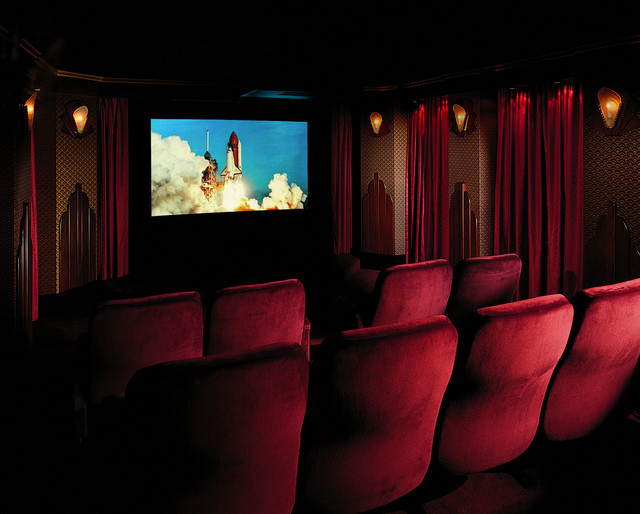
You are a GUI agent. You are given a task and a screenshot of the screen. Output one action in this format:
    pyautogui.click(x=<x>, y=<y>)
    Task: Click on the wall
    Image resolution: width=640 pixels, height=514 pixels.
    Given the screenshot: What is the action you would take?
    pyautogui.click(x=397, y=165), pyautogui.click(x=80, y=172)